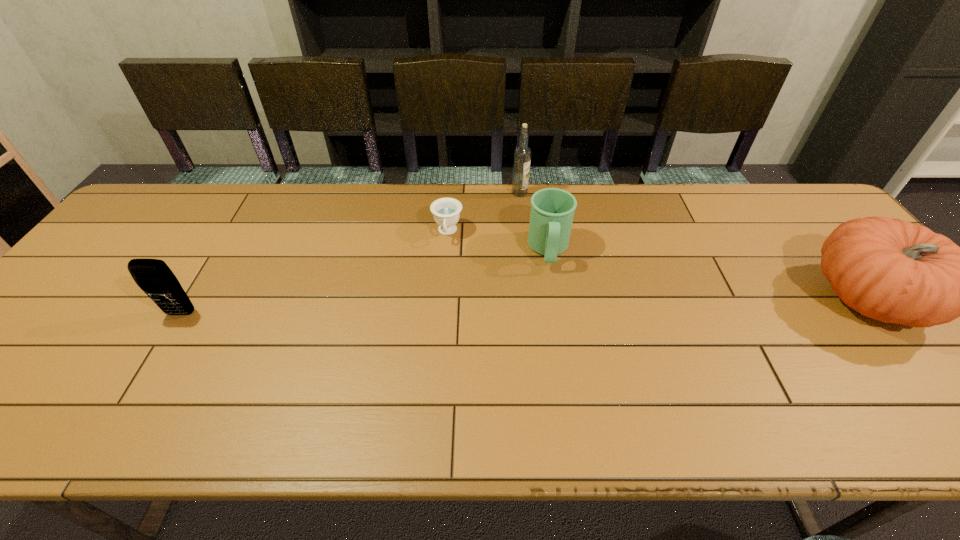
Locate an element on the screen. The image size is (960, 540). free space on the desktop that is between the leftmost object and the pumpkin and is positioned on the label of the vodka is located at coordinates (614, 305).

Image resolution: width=960 pixels, height=540 pixels. Identify the location of free space on the desktop that is between the cellular telephone and the pumpkin and is positioned on the side of the fourth tallest object with the handle. (551, 306).

In order to click on free space on the desktop that is between the leftmost object and the rightmost object and is positioned on the side of the second object from left to right with the handle in this screenshot , I will do `click(439, 308)`.